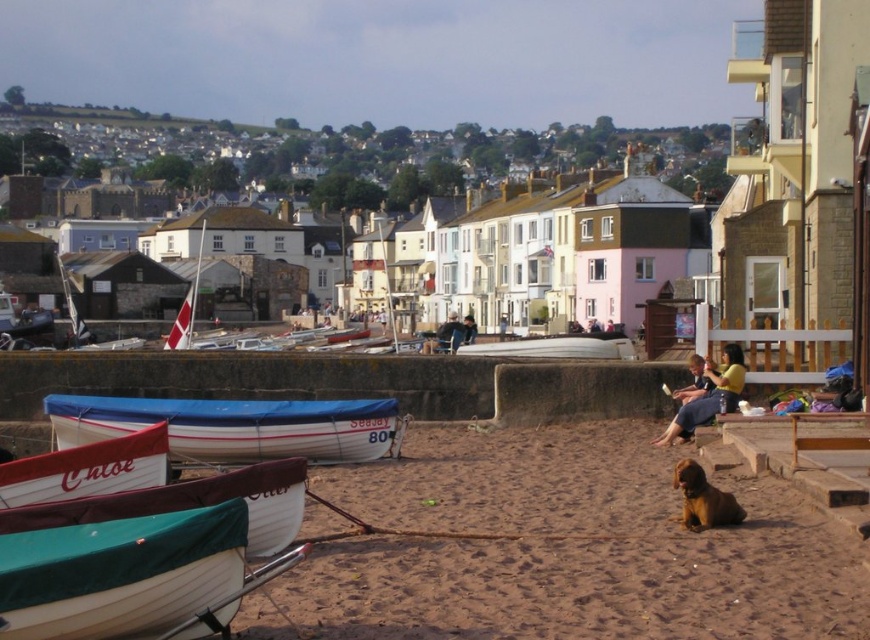
Question: Among these objects, which one is farthest from the camera?

Choices:
 (A) green canvas canoe at lower left
 (B) white canvas boat at lower left
 (C) white matte boat at center
 (D) white striped tarpaulin boat at lower left

Answer: (C)

Question: In this image, where is white matte boat at center located relative to dark blue fabric jacket at center?

Choices:
 (A) right
 (B) left

Answer: (A)

Question: Does brown sandy beach at lower center appear over smooth brown dog at lower right?

Choices:
 (A) yes
 (B) no

Answer: (B)

Question: Which point is closer to the camera?

Choices:
 (A) dark blue fabric jacket at center
 (B) white striped tarpaulin boat at lower left

Answer: (B)

Question: Considering the real-world distances, which object is farthest from the smooth black surfboard at center?

Choices:
 (A) yellow cotton shirt at center
 (B) brown sandy beach at lower center
 (C) smooth brown dog at lower right
 (D) white canvas boat at lower left

Answer: (D)

Question: Is brown sandy beach at lower center positioned behind white striped tarpaulin boat at lower left?

Choices:
 (A) no
 (B) yes

Answer: (A)